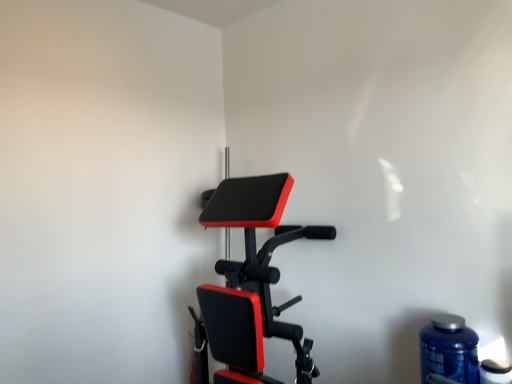
I want to click on matte black stationary bicycle at center, so click(x=250, y=281).

Identify the location of blue plastic bottle at lower right, which is the 2th bottle from left to right. (495, 372).

What are the coordinates of `blue plastic bottle at lower right, the first bottle from the left` in the screenshot? It's located at (449, 349).

Locate an element on the screen. The image size is (512, 384). matte black stationary bicycle at center is located at coordinates coord(250,281).

Is matte black stationary bicycle at center beside blue plastic bottle at lower right, which is counted as the 2th bottle, starting from the right?

They are not placed beside each other.

Can you confirm if matte black stationary bicycle at center is positioned to the right of blue plastic bottle at lower right, which is counted as the 2th bottle, starting from the right?

Incorrect, matte black stationary bicycle at center is not on the right side of blue plastic bottle at lower right, which is counted as the 2th bottle, starting from the right.

From a real-world perspective, which is physically above, matte black stationary bicycle at center or blue plastic bottle at lower right, which is counted as the 2th bottle, starting from the right?

matte black stationary bicycle at center is physically above.

Looking at this image, is blue plastic bottle at lower right, the first bottle from the left, aimed at blue plastic bottle at lower right, which is the 2th bottle from left to right?

No, blue plastic bottle at lower right, the first bottle from the left, is not facing towards blue plastic bottle at lower right, which is the 2th bottle from left to right.

Visually, is blue plastic bottle at lower right, which is counted as the 2th bottle, starting from the right, positioned to the left or to the right of blue plastic bottle at lower right, positioned as the 1th bottle in right-to-left order?

blue plastic bottle at lower right, which is counted as the 2th bottle, starting from the right, is positioned on blue plastic bottle at lower right, positioned as the 1th bottle in right-to-left order,'s left side.

From the image's perspective, who appears lower, blue plastic bottle at lower right, which is counted as the 2th bottle, starting from the right, or blue plastic bottle at lower right, which is the 2th bottle from left to right?

blue plastic bottle at lower right, which is the 2th bottle from left to right.

From a real-world perspective, which is physically above, blue plastic bottle at lower right, which is the 2th bottle from left to right, or blue plastic bottle at lower right, which is counted as the 2th bottle, starting from the right?

In real-world perspective, blue plastic bottle at lower right, which is counted as the 2th bottle, starting from the right, is above.

Is blue plastic bottle at lower right, positioned as the 1th bottle in right-to-left order, next to blue plastic bottle at lower right, the first bottle from the left, and touching it?

No, blue plastic bottle at lower right, positioned as the 1th bottle in right-to-left order, is not in contact with blue plastic bottle at lower right, the first bottle from the left.

Between blue plastic bottle at lower right, which is the 2th bottle from left to right, and blue plastic bottle at lower right, which is counted as the 2th bottle, starting from the right, which one appears on the left side from the viewer's perspective?

blue plastic bottle at lower right, which is counted as the 2th bottle, starting from the right.

From the image's perspective, relative to blue plastic bottle at lower right, the first bottle from the left, is blue plastic bottle at lower right, which is the 2th bottle from left to right, above or below?

Clearly, from the image's perspective, blue plastic bottle at lower right, which is the 2th bottle from left to right, is below blue plastic bottle at lower right, the first bottle from the left.

From a real-world perspective, is blue plastic bottle at lower right, positioned as the 1th bottle in right-to-left order, physically above matte black stationary bicycle at center?

Incorrect, from a real-world perspective, blue plastic bottle at lower right, positioned as the 1th bottle in right-to-left order, is lower than matte black stationary bicycle at center.

Is blue plastic bottle at lower right, which is the 2th bottle from left to right, not close to matte black stationary bicycle at center?

No, blue plastic bottle at lower right, which is the 2th bottle from left to right, is not far away from matte black stationary bicycle at center.

Identify the location of bottle that is the 2nd object directly below the matte black stationary bicycle at center (from a real-world perspective). (495, 372).

Is matte black stationary bicycle at center located within blue plastic bottle at lower right, which is the 2th bottle from left to right?

No, matte black stationary bicycle at center is located outside of blue plastic bottle at lower right, which is the 2th bottle from left to right.

Would you say blue plastic bottle at lower right, which is counted as the 2th bottle, starting from the right, is outside matte black stationary bicycle at center?

blue plastic bottle at lower right, which is counted as the 2th bottle, starting from the right, lies outside matte black stationary bicycle at center's area.

Is blue plastic bottle at lower right, the first bottle from the left, far from matte black stationary bicycle at center?

blue plastic bottle at lower right, the first bottle from the left, is actually quite close to matte black stationary bicycle at center.

From the image's perspective, is blue plastic bottle at lower right, which is counted as the 2th bottle, starting from the right, positioned above or below matte black stationary bicycle at center?

From the image's perspective, blue plastic bottle at lower right, which is counted as the 2th bottle, starting from the right, appears below matte black stationary bicycle at center.

Which of these two, blue plastic bottle at lower right, which is counted as the 2th bottle, starting from the right, or matte black stationary bicycle at center, stands shorter?

With less height is blue plastic bottle at lower right, which is counted as the 2th bottle, starting from the right.

Considering the sizes of matte black stationary bicycle at center and blue plastic bottle at lower right, which is the 2th bottle from left to right, in the image, is matte black stationary bicycle at center taller or shorter than blue plastic bottle at lower right, which is the 2th bottle from left to right,?

Clearly, matte black stationary bicycle at center is taller compared to blue plastic bottle at lower right, which is the 2th bottle from left to right.

From a real-world perspective, between matte black stationary bicycle at center and blue plastic bottle at lower right, positioned as the 1th bottle in right-to-left order, who is vertically lower?

blue plastic bottle at lower right, positioned as the 1th bottle in right-to-left order, is physically lower.

From the image's perspective, does matte black stationary bicycle at center appear higher than blue plastic bottle at lower right, which is the 2th bottle from left to right?

Indeed, from the image's perspective, matte black stationary bicycle at center is shown above blue plastic bottle at lower right, which is the 2th bottle from left to right.

Is matte black stationary bicycle at center touching blue plastic bottle at lower right, positioned as the 1th bottle in right-to-left order?

No, matte black stationary bicycle at center is not next to blue plastic bottle at lower right, positioned as the 1th bottle in right-to-left order.

This screenshot has height=384, width=512. I want to click on stationary bicycle that appears above the blue plastic bottle at lower right, the first bottle from the left (from the image's perspective), so click(250, 281).

Where is `bottle below the blue plastic bottle at lower right, which is counted as the 2th bottle, starting from the right (from the image's perspective)`? bottle below the blue plastic bottle at lower right, which is counted as the 2th bottle, starting from the right (from the image's perspective) is located at coordinates (495, 372).

Which object lies nearer to the anchor point matte black stationary bicycle at center, blue plastic bottle at lower right, which is the 2th bottle from left to right, or blue plastic bottle at lower right, which is counted as the 2th bottle, starting from the right?

Based on the image, blue plastic bottle at lower right, which is counted as the 2th bottle, starting from the right, appears to be nearer to matte black stationary bicycle at center.

Which object lies nearer to the anchor point blue plastic bottle at lower right, which is counted as the 2th bottle, starting from the right, matte black stationary bicycle at center or blue plastic bottle at lower right, positioned as the 1th bottle in right-to-left order?

blue plastic bottle at lower right, positioned as the 1th bottle in right-to-left order, lies closer to blue plastic bottle at lower right, which is counted as the 2th bottle, starting from the right, than the other object.

Estimate the real-world distances between objects in this image. Which object is further from blue plastic bottle at lower right, positioned as the 1th bottle in right-to-left order, blue plastic bottle at lower right, which is counted as the 2th bottle, starting from the right, or matte black stationary bicycle at center?

Based on the image, matte black stationary bicycle at center appears to be further to blue plastic bottle at lower right, positioned as the 1th bottle in right-to-left order.

Which object lies further to the anchor point matte black stationary bicycle at center, blue plastic bottle at lower right, the first bottle from the left, or blue plastic bottle at lower right, which is the 2th bottle from left to right?

The object further to matte black stationary bicycle at center is blue plastic bottle at lower right, which is the 2th bottle from left to right.

Looking at the image, which one is located closer to blue plastic bottle at lower right, the first bottle from the left, blue plastic bottle at lower right, which is the 2th bottle from left to right, or matte black stationary bicycle at center?

The object closer to blue plastic bottle at lower right, the first bottle from the left, is blue plastic bottle at lower right, which is the 2th bottle from left to right.

Based on their spatial positions, is matte black stationary bicycle at center or blue plastic bottle at lower right, which is counted as the 2th bottle, starting from the right, further from blue plastic bottle at lower right, which is the 2th bottle from left to right?

matte black stationary bicycle at center is positioned further to the anchor blue plastic bottle at lower right, which is the 2th bottle from left to right.

You are a GUI agent. You are given a task and a screenshot of the screen. Output one action in this format:
    pyautogui.click(x=<x>, y=<y>)
    Task: Click on the bottle located between matte black stationary bicycle at center and blue plastic bottle at lower right, positioned as the 1th bottle in right-to-left order, in the left-right direction
    
    Given the screenshot: What is the action you would take?
    pyautogui.click(x=449, y=349)